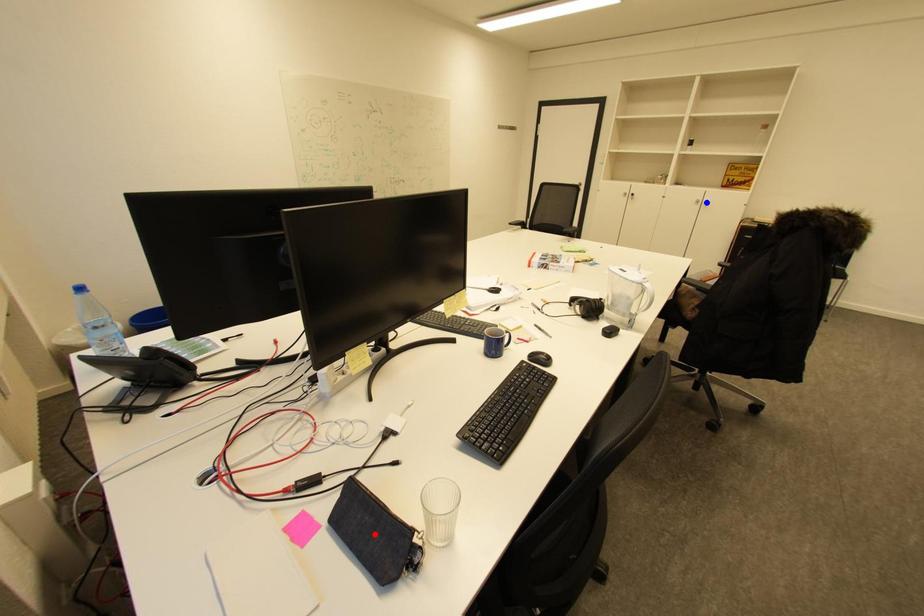
Question: Which of the two points in the image is closer to the camera?

Choices:
 (A) Blue point is closer.
 (B) Red point is closer.

Answer: (B)